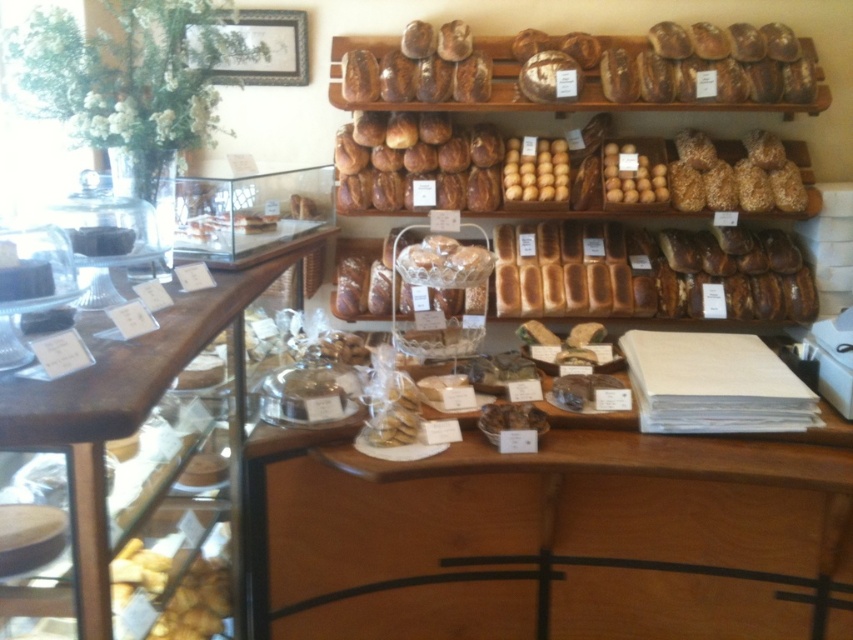
You are a customer looking at the bakery display. You want to pick up the golden brown crumbly pastry at lower left and the yellow matte muffins at center. Which item should you reach for first to get the one that is closer to you?

The golden brown crumbly pastry at lower left is closer to the viewer than the yellow matte muffins at center, so you should reach for the golden brown crumbly pastry at lower left first.